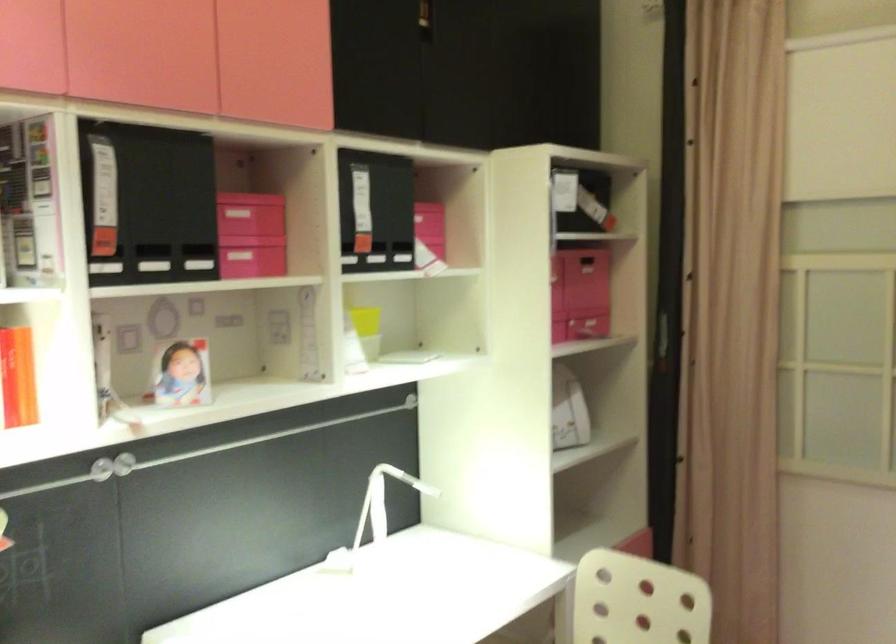
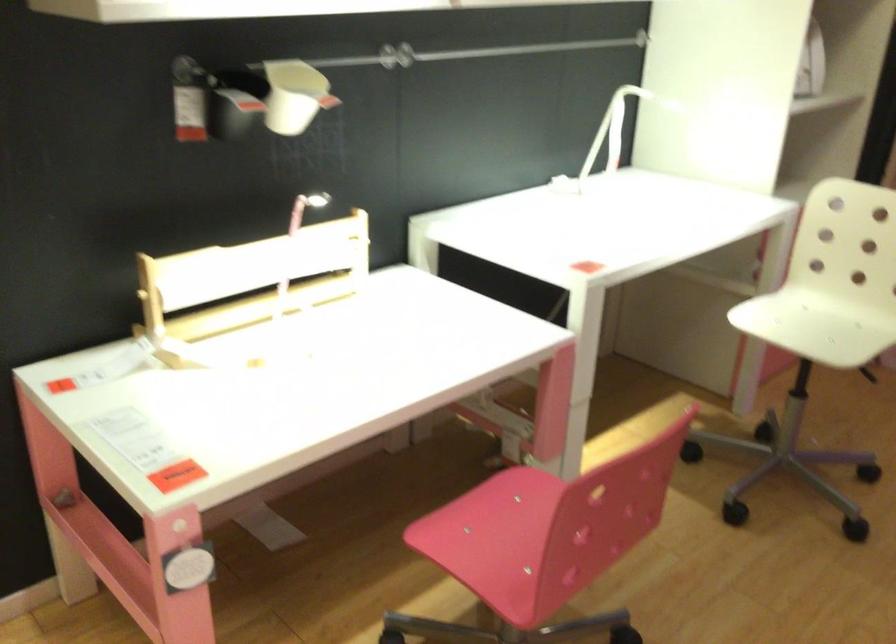
Question: The images are taken continuously from a first-person perspective. In which direction is your viewpoint rotating?

Choices:
 (A) Left
 (B) Right
 (C) Up
 (D) Down

Answer: (D)